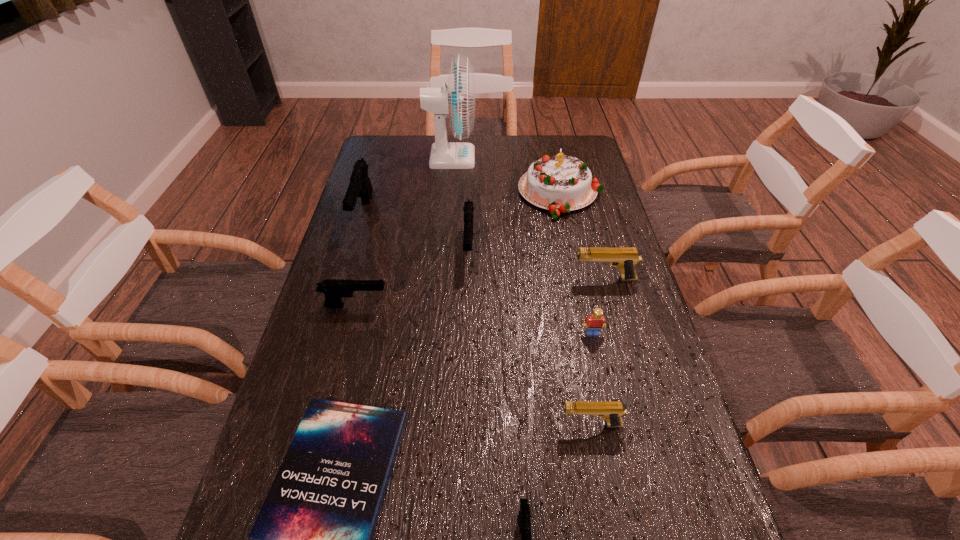
Where is `vacant space located on the front-facing side of the fourth farthest pistol`? The image size is (960, 540). vacant space located on the front-facing side of the fourth farthest pistol is located at coordinates pyautogui.click(x=486, y=306).

Image resolution: width=960 pixels, height=540 pixels. What are the coordinates of `vacant area located on the front-facing side of the Lego` in the screenshot? It's located at (611, 419).

Identify the location of vacant space located 0.310m at the barrel of the nearer tan pistol. (416, 424).

Where is `vacant space located 0.200m at the barrel of the nearer tan pistol`? This screenshot has height=540, width=960. vacant space located 0.200m at the barrel of the nearer tan pistol is located at coordinates (467, 424).

At what (x,y) coordinates should I click in order to perform the action: click on vacant region located 0.370m at the barrel of the nearer tan pistol. Please return your answer as a coordinate pair (x, y). Looking at the image, I should click on (388, 424).

Where is `object present at the far edge`? object present at the far edge is located at coordinates (457, 99).

At what (x,y) coordinates should I click in order to perform the action: click on cake that is positioned at the right edge. Please return your answer as a coordinate pair (x, y). Looking at the image, I should click on (558, 183).

Locate an element on the screen. Lego located in the right edge section of the desktop is located at coordinates (596, 321).

Image resolution: width=960 pixels, height=540 pixels. In order to click on free location at the far edge in this screenshot , I will do `click(433, 141)`.

Locate an element on the screen. The image size is (960, 540). vacant space at the left edge is located at coordinates (384, 189).